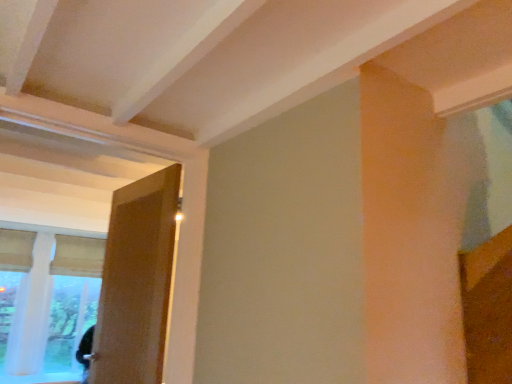
Question: From a real-world perspective, is white sheer curtain at left on wooden door at left?

Choices:
 (A) no
 (B) yes

Answer: (A)

Question: Is white sheer curtain at left oriented away from wooden door at left?

Choices:
 (A) no
 (B) yes

Answer: (A)

Question: Considering the relative sizes of white sheer curtain at left and wooden door at left in the image provided, is white sheer curtain at left smaller than wooden door at left?

Choices:
 (A) yes
 (B) no

Answer: (B)

Question: From the image's perspective, is white sheer curtain at left located beneath wooden door at left?

Choices:
 (A) yes
 (B) no

Answer: (A)

Question: Is white sheer curtain at left to the left of wooden door at left from the viewer's perspective?

Choices:
 (A) yes
 (B) no

Answer: (A)

Question: Could you tell me if white sheer curtain at left is turned towards wooden door at left?

Choices:
 (A) yes
 (B) no

Answer: (A)

Question: Considering the relative positions of wooden door at left and white sheer curtain at left in the image provided, is wooden door at left to the right of white sheer curtain at left from the viewer's perspective?

Choices:
 (A) yes
 (B) no

Answer: (A)

Question: From the image's perspective, would you say wooden door at left is positioned over white sheer curtain at left?

Choices:
 (A) yes
 (B) no

Answer: (A)

Question: Is wooden door at left further to the viewer compared to white sheer curtain at left?

Choices:
 (A) no
 (B) yes

Answer: (A)

Question: From the image's perspective, is wooden door at left beneath white sheer curtain at left?

Choices:
 (A) yes
 (B) no

Answer: (B)

Question: Does wooden door at left have a greater width compared to white sheer curtain at left?

Choices:
 (A) yes
 (B) no

Answer: (B)

Question: From a real-world perspective, is wooden door at left under white sheer curtain at left?

Choices:
 (A) yes
 (B) no

Answer: (B)

Question: Considering the relative positions of white sheer curtain at left and wooden door at left in the image provided, is white sheer curtain at left to the left or to the right of wooden door at left?

Choices:
 (A) right
 (B) left

Answer: (B)